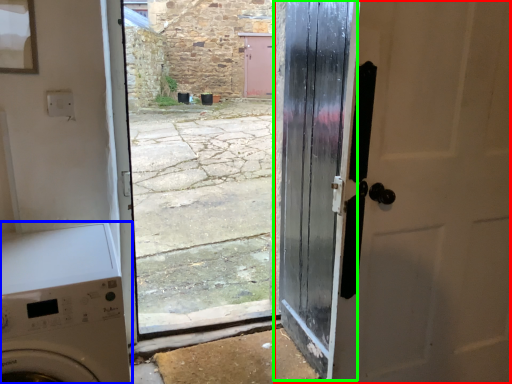
Question: Based on their relative distances, which object is farther from door (highlighted by a red box)? Choose from washing machine (highlighted by a blue box) and door (highlighted by a green box).

Choices:
 (A) washing machine
 (B) door

Answer: (A)